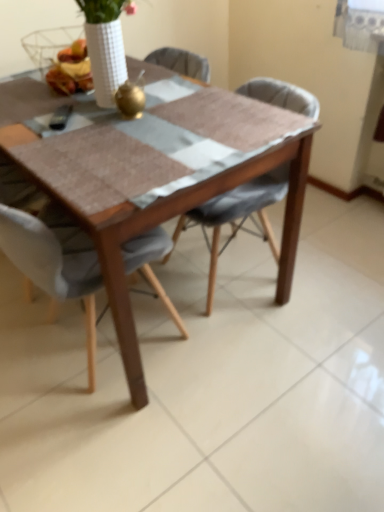
Question: Does wooden table at center have a greater width compared to light gray fabric chair at center, which appears as the second chair when viewed from the right?

Choices:
 (A) no
 (B) yes

Answer: (B)

Question: From the image's perspective, is wooden table at center located above light gray fabric chair at center, which appears as the second chair when viewed from the right?

Choices:
 (A) no
 (B) yes

Answer: (B)

Question: Is the position of wooden table at center less distant than that of light gray fabric chair at center, placed as the first chair when sorted from left to right?

Choices:
 (A) no
 (B) yes

Answer: (A)

Question: Is wooden table at center smaller than light gray fabric chair at center, placed as the first chair when sorted from left to right?

Choices:
 (A) yes
 (B) no

Answer: (B)

Question: Considering the relative sizes of wooden table at center and light gray fabric chair at center, placed as the first chair when sorted from left to right, in the image provided, is wooden table at center taller than light gray fabric chair at center, placed as the first chair when sorted from left to right,?

Choices:
 (A) yes
 (B) no

Answer: (B)

Question: Choose the correct answer: Is wooden table at center inside textured gray chair at center, the second chair from the left, or outside it?

Choices:
 (A) inside
 (B) outside

Answer: (B)

Question: From a real-world perspective, is wooden table at center physically located above or below textured gray chair at center, the second chair from the left?

Choices:
 (A) above
 (B) below

Answer: (A)

Question: In the image, is wooden table at center on the left side or the right side of textured gray chair at center, the second chair from the left?

Choices:
 (A) left
 (B) right

Answer: (A)

Question: In terms of size, does wooden table at center appear bigger or smaller than textured gray chair at center, the second chair from the left?

Choices:
 (A) big
 (B) small

Answer: (A)

Question: In terms of height, does light gray fabric chair at center, placed as the first chair when sorted from left to right, look taller or shorter compared to matte yellow cheese at upper center?

Choices:
 (A) tall
 (B) short

Answer: (A)

Question: Relative to matte yellow cheese at upper center, is light gray fabric chair at center, which appears as the second chair when viewed from the right, in front or behind?

Choices:
 (A) front
 (B) behind

Answer: (A)

Question: Would you say light gray fabric chair at center, which appears as the second chair when viewed from the right, is to the left or to the right of matte yellow cheese at upper center in the picture?

Choices:
 (A) right
 (B) left

Answer: (A)

Question: Is light gray fabric chair at center, which appears as the second chair when viewed from the right, inside or outside of matte yellow cheese at upper center?

Choices:
 (A) outside
 (B) inside

Answer: (A)

Question: From their relative heights in the image, would you say light gray fabric chair at center, which appears as the second chair when viewed from the right, is taller or shorter than wooden table at center?

Choices:
 (A) tall
 (B) short

Answer: (A)

Question: Looking at their shapes, would you say light gray fabric chair at center, placed as the first chair when sorted from left to right, is wider or thinner than wooden table at center?

Choices:
 (A) wide
 (B) thin

Answer: (B)